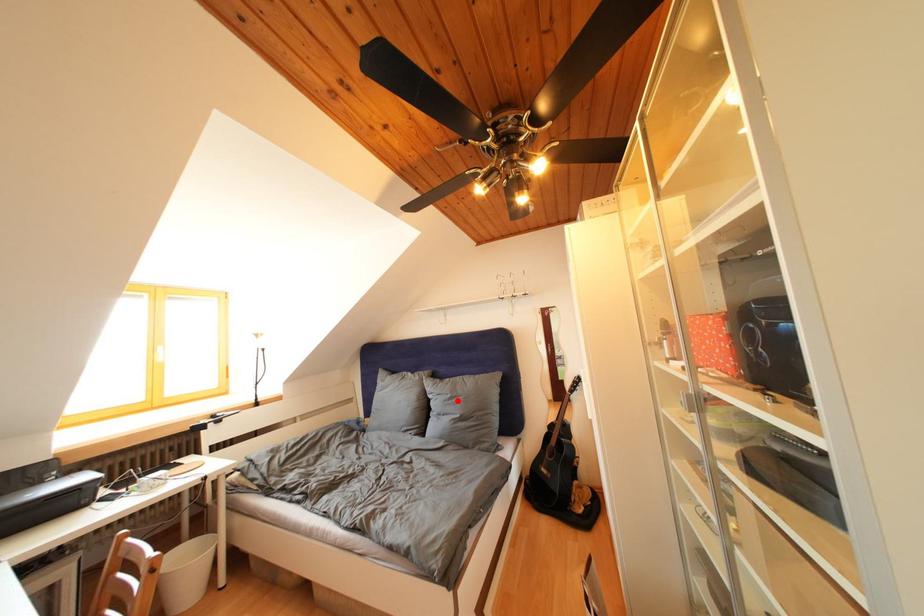
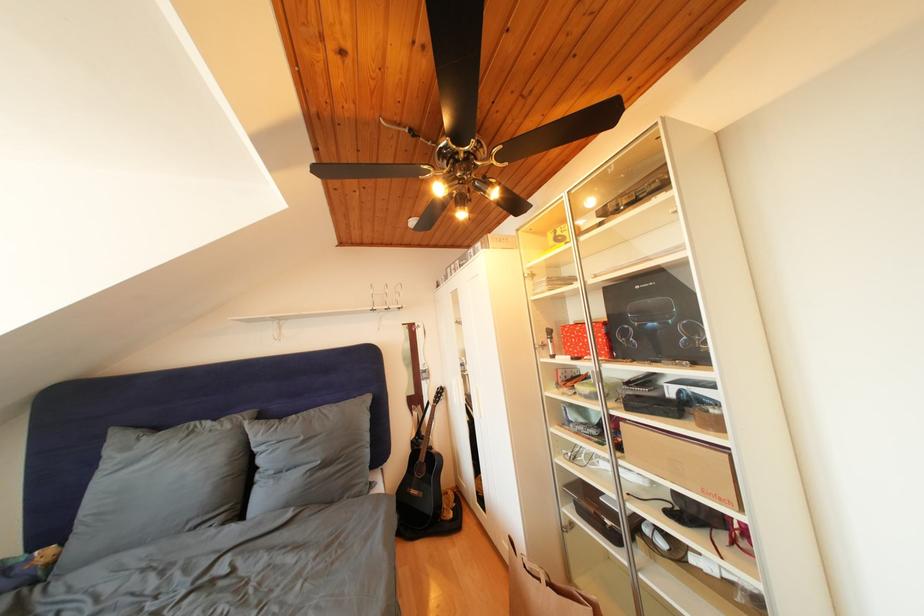
Where in the second image is the point corresponding to the highlighted location from the first image?

(310, 444)